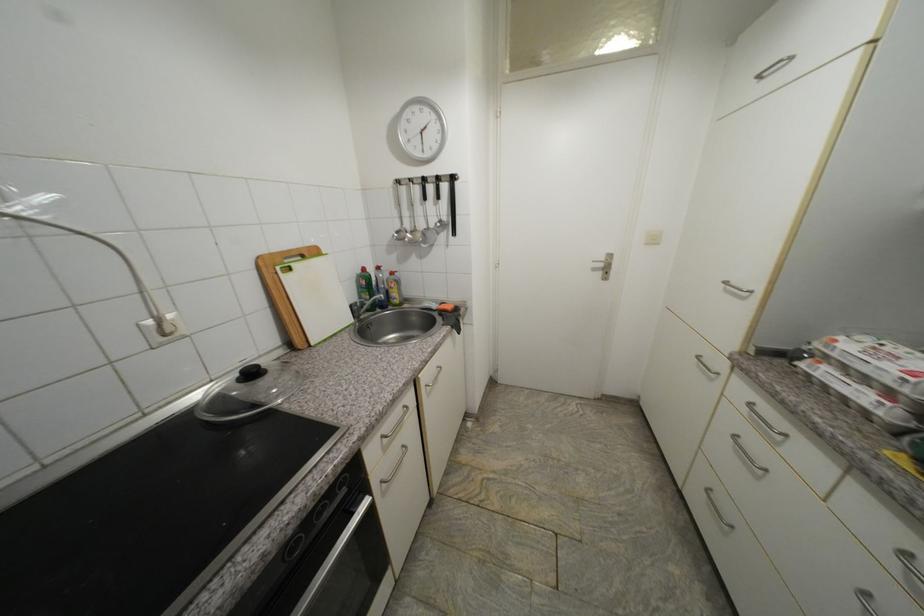
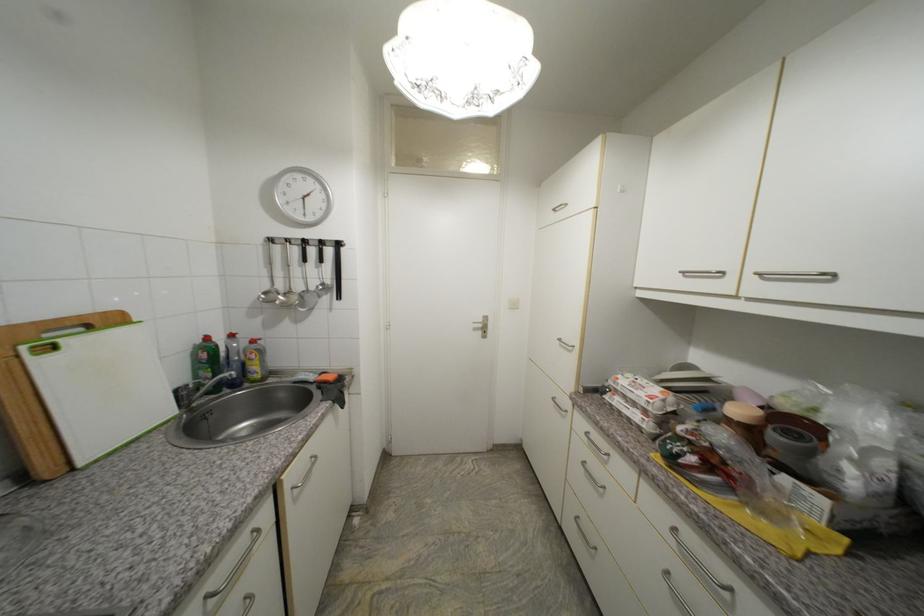
Where in the second image is the point corresponding to [750,411] from the first image?

(590, 440)